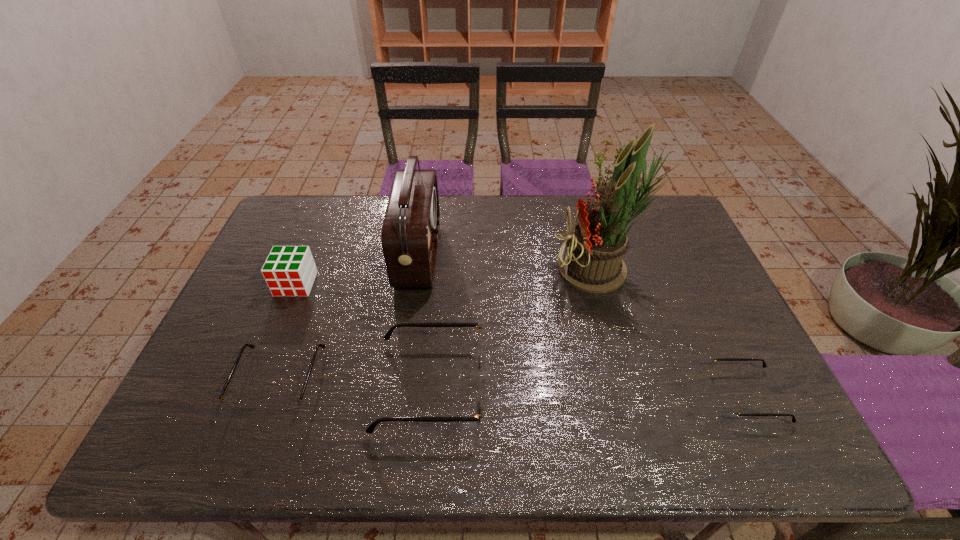
Find the location of a particular element. The image size is (960, 540). spectacles located in the left edge section of the desktop is located at coordinates (284, 405).

Find the location of `cube at the left edge`. cube at the left edge is located at coordinates (288, 270).

You are a GUI agent. You are given a task and a screenshot of the screen. Output one action in this format:
    pyautogui.click(x=<x>, y=<y>)
    Task: Click on the object that is at the right edge
    
    Given the screenshot: What is the action you would take?
    pyautogui.click(x=729, y=407)

Where is `object that is at the near left corner`? object that is at the near left corner is located at coordinates (284, 405).

Identify the location of object that is at the near right corner. (729, 407).

The height and width of the screenshot is (540, 960). In order to click on vacant space at the far edge of the desktop in this screenshot , I will do `click(552, 235)`.

Find the location of a particular element. The width and height of the screenshot is (960, 540). free region at the near edge of the desktop is located at coordinates (610, 401).

In order to click on free spot at the left edge of the desktop in this screenshot , I will do click(x=244, y=343).

In the image, there is a desktop. Where is `vacant area at the right edge`? vacant area at the right edge is located at coordinates tap(722, 312).

I want to click on free space at the far left corner, so click(x=323, y=210).